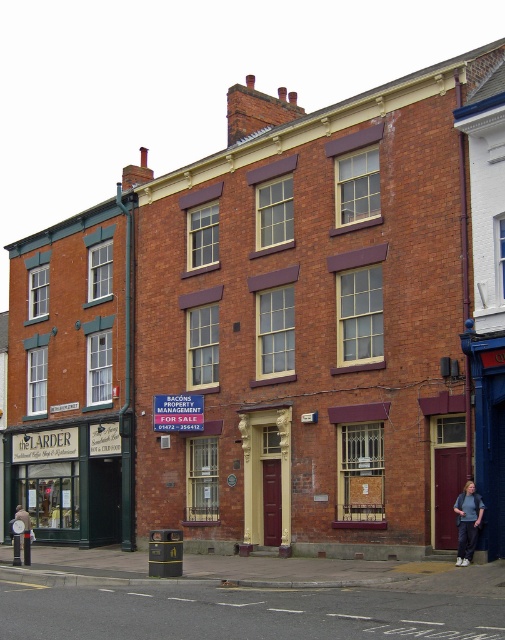
Who is lower down, green wood signboard at lower left or denim pants at lower right?

green wood signboard at lower left is lower down.

Can you confirm if green wood signboard at lower left is positioned below denim pants at lower right?

Correct, green wood signboard at lower left is located below denim pants at lower right.

Does point (104, 509) lie behind point (468, 561)?

Yes, point (104, 509) is behind point (468, 561).

Find the location of a particular element. This screenshot has height=640, width=505. green wood signboard at lower left is located at coordinates (106, 492).